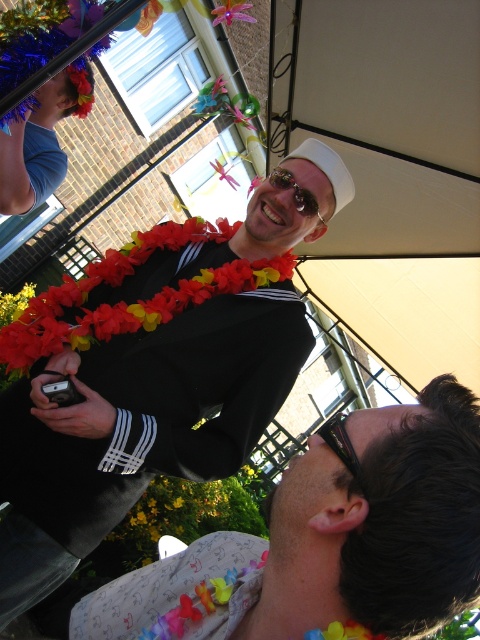
Question: Among these objects, which one is nearest to the camera?

Choices:
 (A) sunglasses at center
 (B) white fabric canopy at upper center
 (C) multicolored fabric lei at lower center

Answer: (C)

Question: Where is floral lei at center located in relation to floral lei at upper center in the image?

Choices:
 (A) left
 (B) right

Answer: (B)

Question: Is satin black sailor at upper center to the right of pink fabric flower at upper center from the viewer's perspective?

Choices:
 (A) yes
 (B) no

Answer: (A)

Question: Can you confirm if satin black sailor suit at upper center is wider than pink fabric flower at upper center?

Choices:
 (A) no
 (B) yes

Answer: (B)

Question: Which of the following is the farthest from the observer?

Choices:
 (A) (142, 8)
 (B) (252, 627)
 (C) (345, 632)

Answer: (A)

Question: Which point appears farthest from the camera in this image?

Choices:
 (A) (152, 24)
 (B) (215, 168)

Answer: (B)